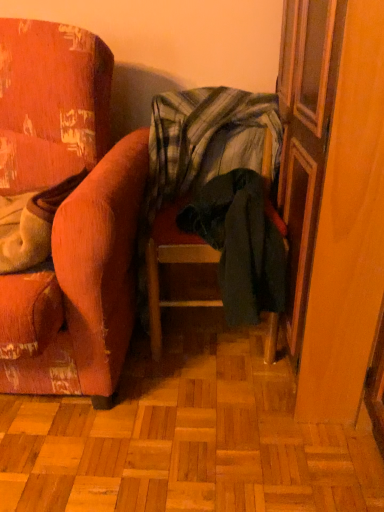
Question: Is wooden screen door at right positioned with its back to plaid fabric blanket at center?

Choices:
 (A) no
 (B) yes

Answer: (B)

Question: Can you confirm if wooden screen door at right is shorter than plaid fabric blanket at center?

Choices:
 (A) yes
 (B) no

Answer: (B)

Question: Does wooden screen door at right appear on the right side of plaid fabric blanket at center?

Choices:
 (A) no
 (B) yes

Answer: (B)

Question: From a real-world perspective, is wooden screen door at right over plaid fabric blanket at center?

Choices:
 (A) no
 (B) yes

Answer: (A)

Question: Does wooden screen door at right appear on the left side of plaid fabric blanket at center?

Choices:
 (A) no
 (B) yes

Answer: (A)

Question: Based on their sizes in the image, would you say velvet orange armchair at left, which is counted as the 2th chair, starting from the right, is bigger or smaller than plaid fabric blanket at center?

Choices:
 (A) big
 (B) small

Answer: (A)

Question: Is point (1, 103) closer or farther from the camera than point (153, 184)?

Choices:
 (A) closer
 (B) farther

Answer: (A)

Question: Choose the correct answer: Is velvet orange armchair at left, which is counted as the 2th chair, starting from the right, inside plaid fabric blanket at center or outside it?

Choices:
 (A) outside
 (B) inside

Answer: (A)

Question: From the image's perspective, relative to plaid fabric blanket at center, is velvet orange armchair at left, which is counted as the 2th chair, starting from the right, above or below?

Choices:
 (A) above
 (B) below

Answer: (B)

Question: Would you say dark green fabric chair at center, the 1th chair in the right-to-left sequence, is to the left or to the right of velvet orange armchair at left, which is counted as the 2th chair, starting from the right, in the picture?

Choices:
 (A) left
 (B) right

Answer: (B)

Question: Based on their sizes in the image, would you say dark green fabric chair at center, the second chair in the left-to-right sequence, is bigger or smaller than velvet orange armchair at left, acting as the 1th chair starting from the left?

Choices:
 (A) big
 (B) small

Answer: (B)

Question: In terms of height, does dark green fabric chair at center, the second chair in the left-to-right sequence, look taller or shorter compared to velvet orange armchair at left, acting as the 1th chair starting from the left?

Choices:
 (A) tall
 (B) short

Answer: (B)

Question: Looking at their shapes, would you say dark green fabric chair at center, the 1th chair in the right-to-left sequence, is wider or thinner than velvet orange armchair at left, which is counted as the 2th chair, starting from the right?

Choices:
 (A) thin
 (B) wide

Answer: (A)

Question: Relative to wooden screen door at right, is plaid fabric blanket at center in front or behind?

Choices:
 (A) front
 (B) behind

Answer: (B)

Question: Which is correct: plaid fabric blanket at center is inside wooden screen door at right, or outside of it?

Choices:
 (A) inside
 (B) outside

Answer: (B)